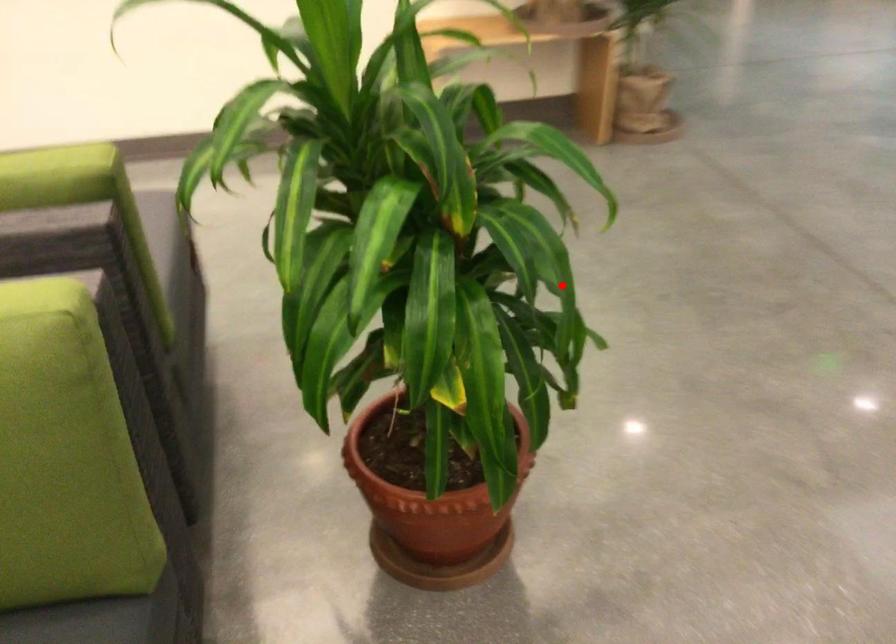
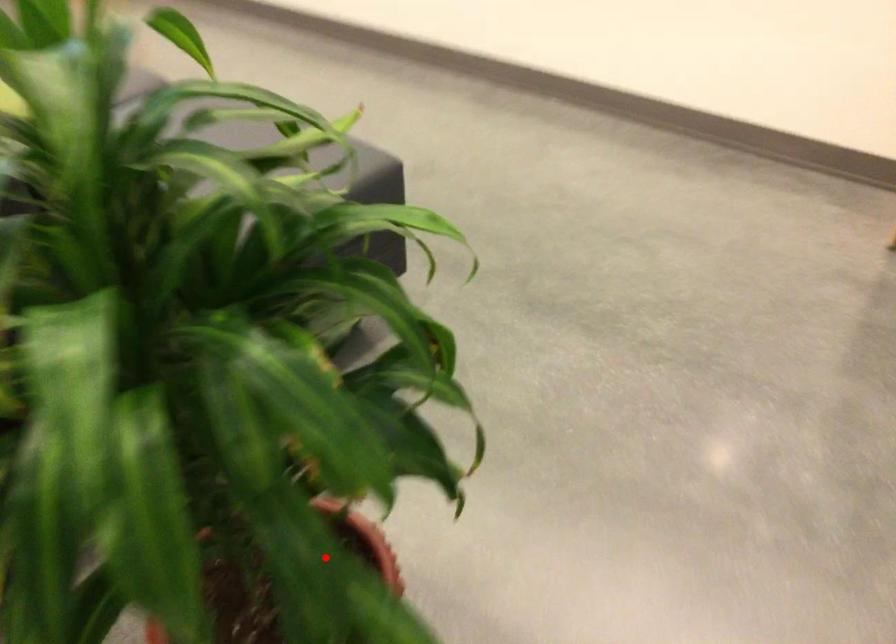
I am providing you with two images of the same scene from different viewpoints. A red point is marked on the first image and another point is marked on the second image. Does the point marked in image1 correspond to the same location as the one in image2?

Yes